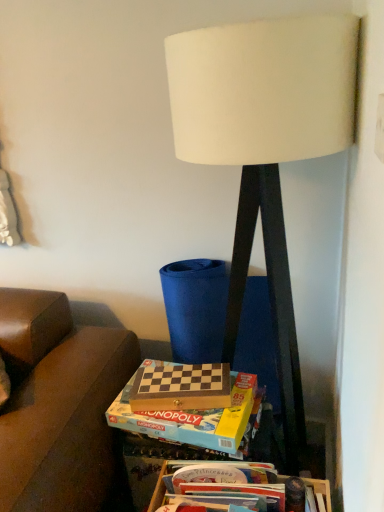
Question: Is white fabric lampshade at center located outside wooden chessboard at center?

Choices:
 (A) yes
 (B) no

Answer: (A)

Question: Does white fabric lampshade at center have a lesser height compared to wooden chessboard at center?

Choices:
 (A) no
 (B) yes

Answer: (A)

Question: Is white fabric lampshade at center positioned in front of wooden chessboard at center?

Choices:
 (A) no
 (B) yes

Answer: (B)

Question: From the image's perspective, does white fabric lampshade at center appear lower than wooden chessboard at center?

Choices:
 (A) yes
 (B) no

Answer: (B)

Question: From a real-world perspective, is white fabric lampshade at center on wooden chessboard at center?

Choices:
 (A) yes
 (B) no

Answer: (A)

Question: Is white fabric lampshade at center positioned behind wooden chessboard at center?

Choices:
 (A) no
 (B) yes

Answer: (A)

Question: Is white fabric lampshade at center thinner than wooden board game at center?

Choices:
 (A) yes
 (B) no

Answer: (B)

Question: Considering the relative positions of white fabric lampshade at center and wooden board game at center in the image provided, is white fabric lampshade at center to the left of wooden board game at center from the viewer's perspective?

Choices:
 (A) yes
 (B) no

Answer: (B)

Question: Does white fabric lampshade at center have a lesser height compared to wooden board game at center?

Choices:
 (A) yes
 (B) no

Answer: (B)

Question: Is white fabric lampshade at center closer to camera compared to wooden board game at center?

Choices:
 (A) yes
 (B) no

Answer: (A)

Question: Is white fabric lampshade at center facing away from wooden board game at center?

Choices:
 (A) yes
 (B) no

Answer: (B)

Question: Can you confirm if white fabric lampshade at center is taller than wooden board game at center?

Choices:
 (A) yes
 (B) no

Answer: (A)

Question: From a real-world perspective, is wooden board game at center located beneath wooden board game at lower center, which appears as the second box when viewed from the top?

Choices:
 (A) yes
 (B) no

Answer: (B)